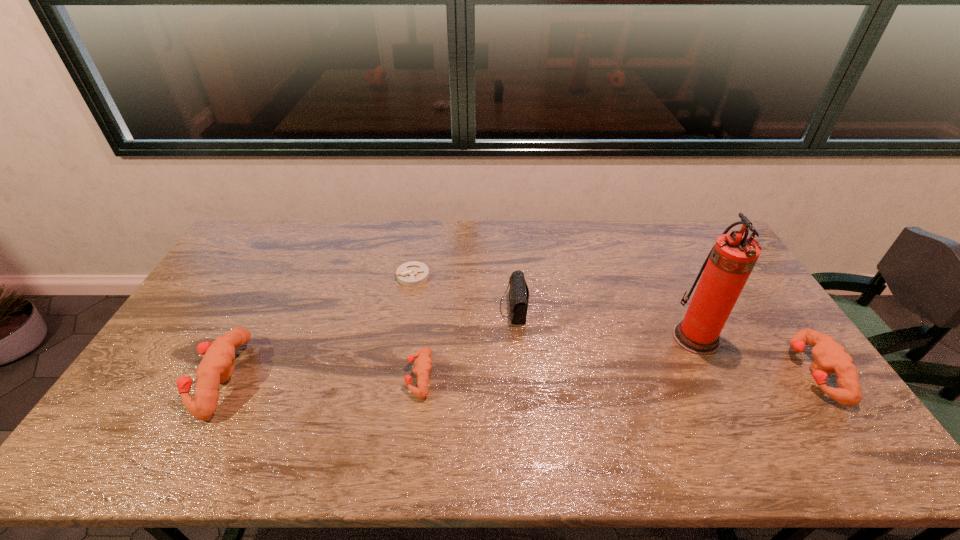
At what (x,y) coordinates should I click in order to perform the action: click on free space located on the front flap of the clutch bag. Please return your answer as a coordinate pair (x, y). Looking at the image, I should click on (430, 308).

This screenshot has height=540, width=960. I want to click on free region located 0.300m at the discharge end of the tallest object, so click(572, 338).

The height and width of the screenshot is (540, 960). What are the coordinates of `free space located 0.140m at the discharge end of the tallest object` in the screenshot? It's located at 626,338.

You are a GUI agent. You are given a task and a screenshot of the screen. Output one action in this format:
    pyautogui.click(x=<x>, y=<y>)
    Task: Click on the vacant region located 0.390m at the discharge end of the tallest object
    The image size is (960, 540).
    Given the screenshot: What is the action you would take?
    pyautogui.click(x=541, y=338)

Locate an element on the screen. The width and height of the screenshot is (960, 540). object that is positioned at the left edge is located at coordinates (217, 366).

Where is `object situated at the right edge`? Image resolution: width=960 pixels, height=540 pixels. object situated at the right edge is located at coordinates (830, 357).

Locate an element on the screen. The height and width of the screenshot is (540, 960). object situated at the near left corner is located at coordinates (217, 366).

The width and height of the screenshot is (960, 540). What are the coordinates of `object that is at the near right corner` in the screenshot? It's located at (830, 357).

In order to click on vacant space at the far edge of the desktop in this screenshot , I will do point(487,236).

This screenshot has width=960, height=540. In the image, there is a desktop. Identify the location of vacant space at the near edge. [598, 409].